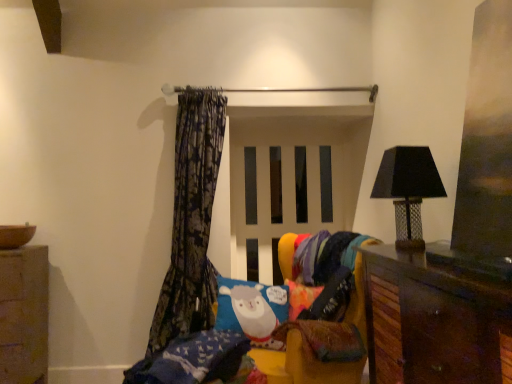
Question: Would you say smooth stone cabinet at lower left is a long distance from multicolored knitted blanket at lower right?

Choices:
 (A) no
 (B) yes

Answer: (B)

Question: Does smooth stone cabinet at lower left have a greater height compared to multicolored knitted blanket at lower right?

Choices:
 (A) yes
 (B) no

Answer: (A)

Question: Is smooth stone cabinet at lower left wider than multicolored knitted blanket at lower right?

Choices:
 (A) no
 (B) yes

Answer: (B)

Question: Is smooth stone cabinet at lower left oriented away from multicolored knitted blanket at lower right?

Choices:
 (A) yes
 (B) no

Answer: (B)

Question: Does smooth stone cabinet at lower left have a lesser width compared to multicolored knitted blanket at lower right?

Choices:
 (A) yes
 (B) no

Answer: (B)

Question: Is point (338, 263) closer or farther from the camera than point (404, 294)?

Choices:
 (A) closer
 (B) farther

Answer: (B)

Question: Do you think multicolored knitted blanket at lower right is within brown wooden cabinet at lower right, or outside of it?

Choices:
 (A) outside
 (B) inside

Answer: (A)

Question: From the image's perspective, is multicolored knitted blanket at lower right above or below brown wooden cabinet at lower right?

Choices:
 (A) above
 (B) below

Answer: (A)

Question: Based on their sizes in the image, would you say multicolored knitted blanket at lower right is bigger or smaller than brown wooden cabinet at lower right?

Choices:
 (A) small
 (B) big

Answer: (A)

Question: Relative to dark floral fabric curtain at left, is multicolored knitted blanket at lower right in front or behind?

Choices:
 (A) behind
 (B) front

Answer: (B)

Question: Looking at the image, does multicolored knitted blanket at lower right seem bigger or smaller compared to dark floral fabric curtain at left?

Choices:
 (A) small
 (B) big

Answer: (A)

Question: Does point (335, 312) appear closer or farther from the camera than point (157, 306)?

Choices:
 (A) closer
 (B) farther

Answer: (A)

Question: Is multicolored knitted blanket at lower right taller or shorter than dark floral fabric curtain at left?

Choices:
 (A) short
 (B) tall

Answer: (A)

Question: In terms of height, does brown wooden cabinet at lower right look taller or shorter compared to multicolored knitted blanket at lower right?

Choices:
 (A) short
 (B) tall

Answer: (B)

Question: Looking at their shapes, would you say brown wooden cabinet at lower right is wider or thinner than multicolored knitted blanket at lower right?

Choices:
 (A) thin
 (B) wide

Answer: (B)